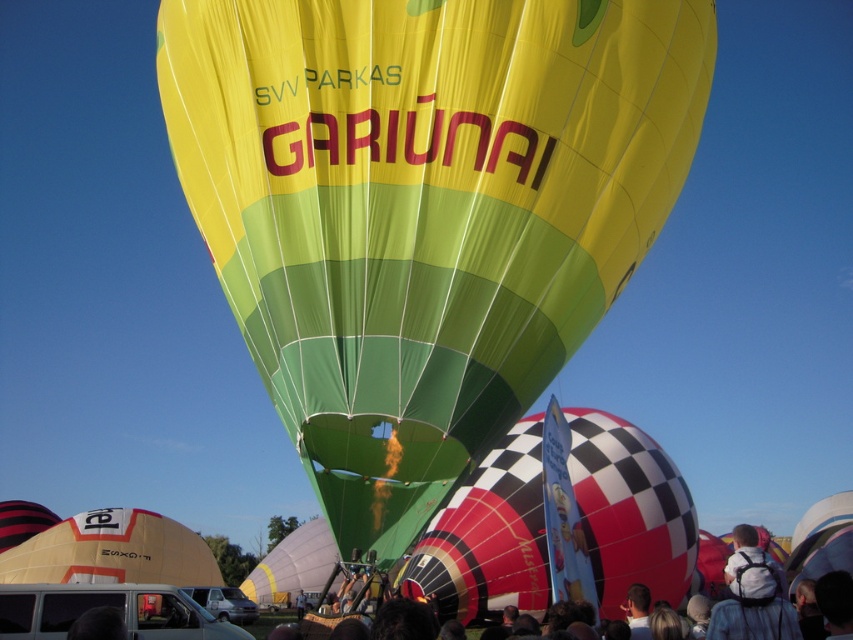
You are a hiker who just arrived at the hot air balloon festival. You need to set up your white backpack at lower right near your matte yellow tent at lower left. Based on the scene, can you safely place them close together without violating the festival spacing rules that require at least 100 meters between items?

The matte yellow tent at lower left and white backpack at lower right are 99.05 meters apart from each other. Since the required distance is 100 meters, placing them at 99.05 meters would violate the festival spacing rules as it is less than the required distance.